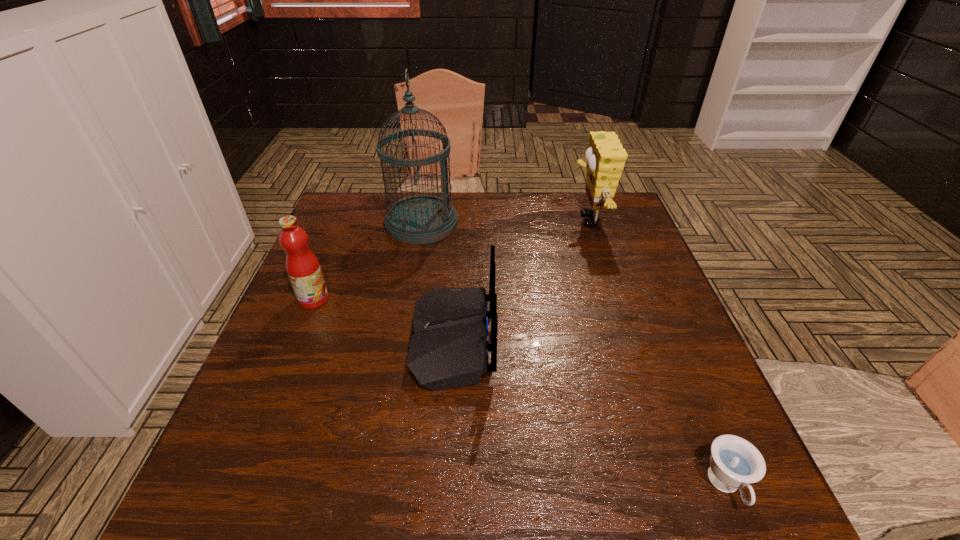
Where is `vacant area at the far edge of the desktop`? This screenshot has height=540, width=960. vacant area at the far edge of the desktop is located at coordinates 541,200.

The image size is (960, 540). I want to click on vacant space at the near edge of the desktop, so click(x=655, y=508).

In the image, there is a desktop. What are the coordinates of `free space at the left edge` in the screenshot? It's located at (292, 367).

In the image, there is a desktop. Identify the location of vacant space at the right edge. This screenshot has height=540, width=960. (661, 343).

Locate an element on the screen. vacant region at the far left corner is located at coordinates (338, 222).

What are the coordinates of `free space at the far right corner of the desktop` in the screenshot? It's located at (625, 233).

Where is `blank region between the teacup and the tallest object`? The width and height of the screenshot is (960, 540). blank region between the teacup and the tallest object is located at coordinates (574, 354).

I want to click on free space between the shortest object and the leftmost object, so click(x=519, y=393).

The image size is (960, 540). What are the coordinates of `free space that is in between the fruit juice and the nearest object` in the screenshot? It's located at (519, 393).

Locate an element on the screen. This screenshot has height=540, width=960. free space that is in between the fourth tallest object and the leftmost object is located at coordinates (383, 320).